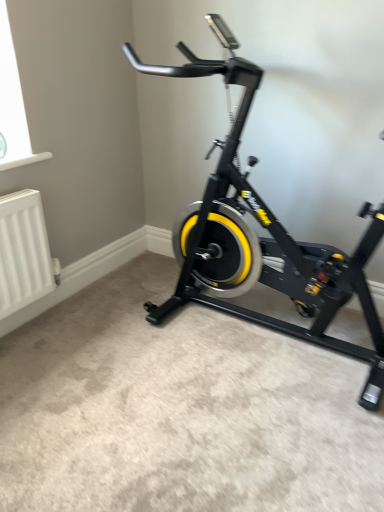
The height and width of the screenshot is (512, 384). What do you see at coordinates (263, 237) in the screenshot?
I see `black matte stationary bicycle at center` at bounding box center [263, 237].

Where is `black matte stationary bicycle at center`? The height and width of the screenshot is (512, 384). black matte stationary bicycle at center is located at coordinates (263, 237).

Find the location of a particular element. The width and height of the screenshot is (384, 512). black matte stationary bicycle at center is located at coordinates (263, 237).